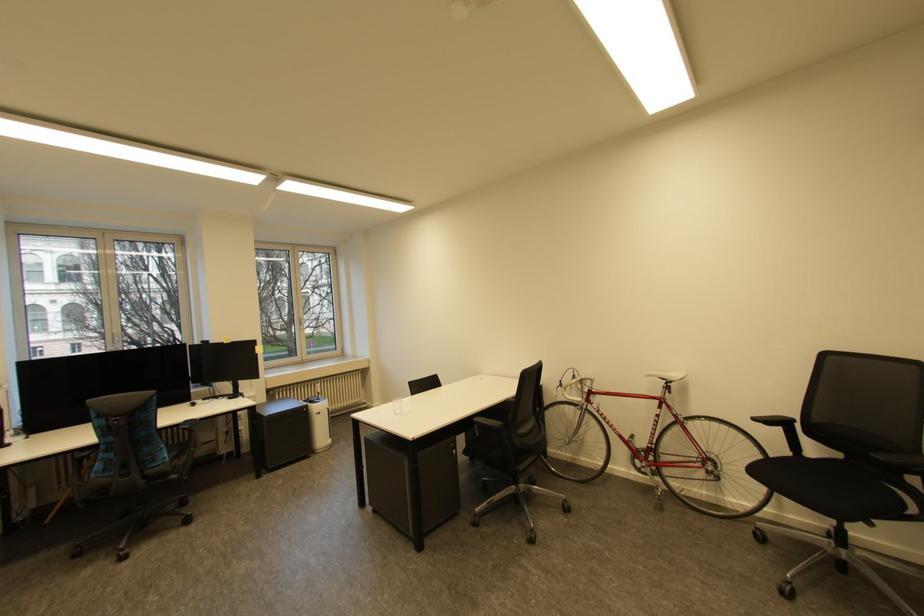
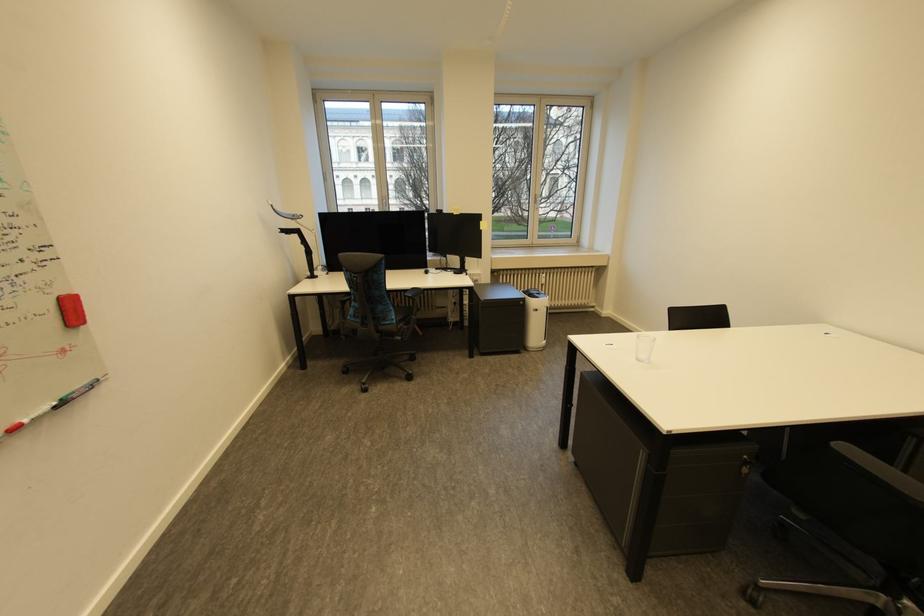
In the second image, find the point that corresponds to pixel 402 415 in the first image.

(646, 361)